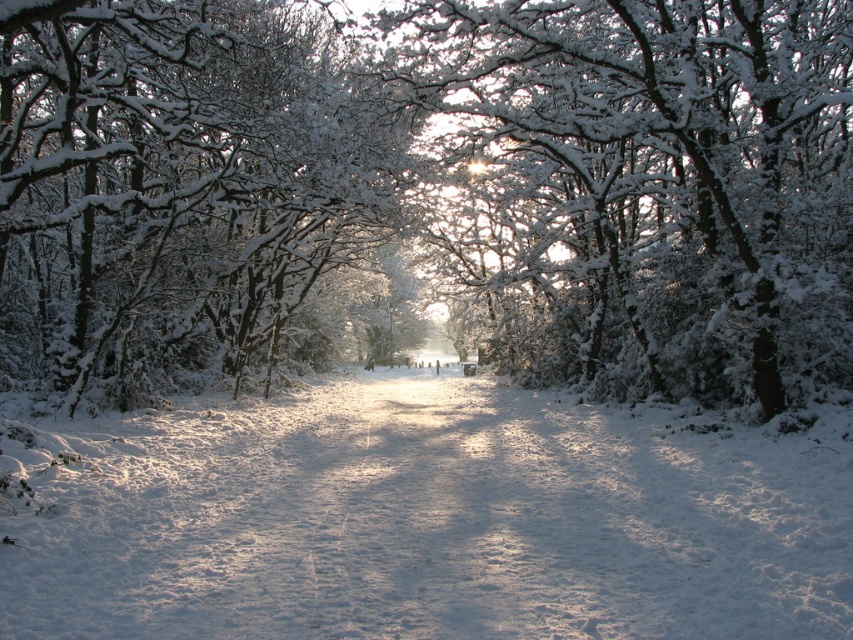
Question: Is white snow-covered tree at center to the right of white frosty branches at center from the viewer's perspective?

Choices:
 (A) yes
 (B) no

Answer: (A)

Question: Which of the following is the closest to the observer?

Choices:
 (A) (753, 476)
 (B) (68, 134)
 (C) (764, 83)

Answer: (A)

Question: Which point appears farthest from the camera in this image?

Choices:
 (A) (351, 113)
 (B) (815, 161)
 (C) (575, 488)

Answer: (B)

Question: Does white snow at center come behind white frosty branches at center?

Choices:
 (A) no
 (B) yes

Answer: (A)

Question: Which of the following is the farthest from the observer?

Choices:
 (A) (212, 60)
 (B) (833, 212)

Answer: (A)

Question: Considering the relative positions of white snow at center and white frosty branches at center in the image provided, where is white snow at center located with respect to white frosty branches at center?

Choices:
 (A) below
 (B) above

Answer: (A)